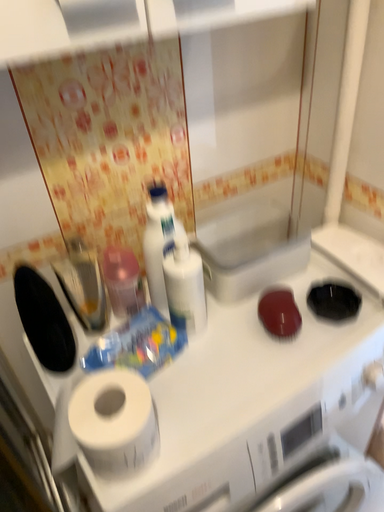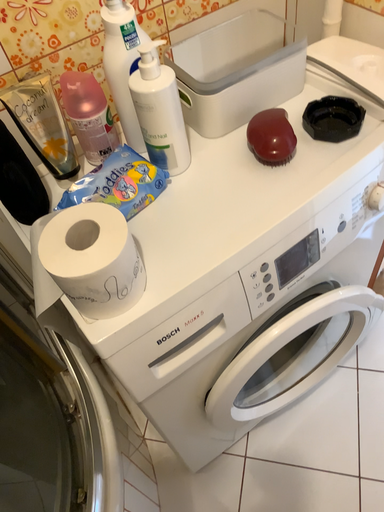
Question: Which way did the camera rotate in the video?

Choices:
 (A) rotated upward
 (B) rotated downward

Answer: (B)